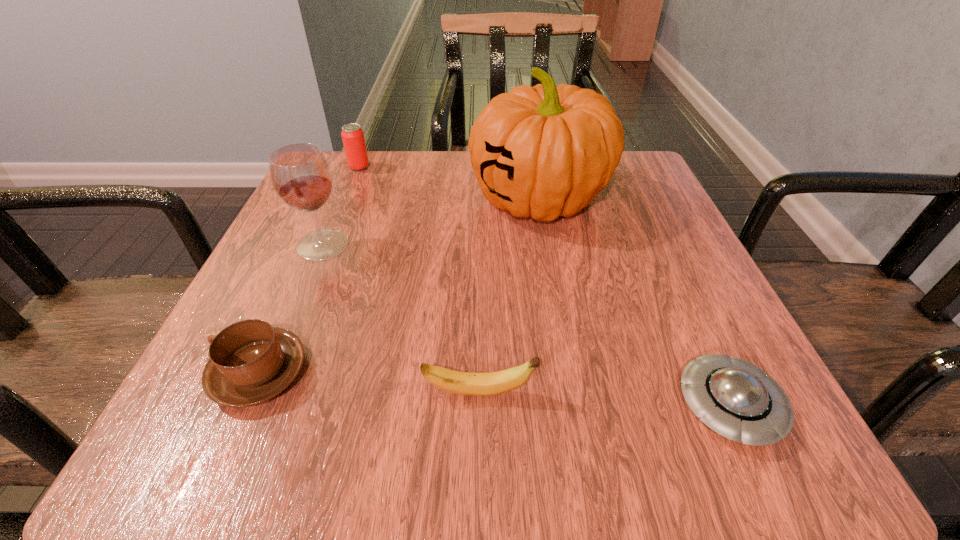
Find the location of `vacant area that lies between the saucer and the banana`. vacant area that lies between the saucer and the banana is located at coordinates (604, 399).

This screenshot has height=540, width=960. Identify the location of free space that is in between the cappuccino and the second tallest object. (291, 309).

Locate an element on the screen. The width and height of the screenshot is (960, 540). blank region between the banana and the pumpkin is located at coordinates (509, 296).

Locate which object is the fifth closest to the saucer. Please provide its 2D coordinates. Your answer should be formatted as a tuple, i.e. [(x, y)], where the tuple contains the x and y coordinates of a point satisfying the conditions above.

[(353, 139)]

Identify the location of the fourth closest object to the saucer. This screenshot has height=540, width=960. 301,176.

This screenshot has height=540, width=960. I want to click on free region that satisfies the following two spatial constraints: 1. on the surface of the pumpkin; 2. on the front side of the second tallest object, so click(546, 245).

Locate an element on the screen. The height and width of the screenshot is (540, 960). vacant space that satisfies the following two spatial constraints: 1. on the back side of the second tallest object; 2. on the right side of the third tallest object is located at coordinates (355, 167).

This screenshot has width=960, height=540. Find the location of `vacant space that satisfies the following two spatial constraints: 1. on the front side of the beer can; 2. on the side of the cappuccino with the handle`. vacant space that satisfies the following two spatial constraints: 1. on the front side of the beer can; 2. on the side of the cappuccino with the handle is located at coordinates (277, 373).